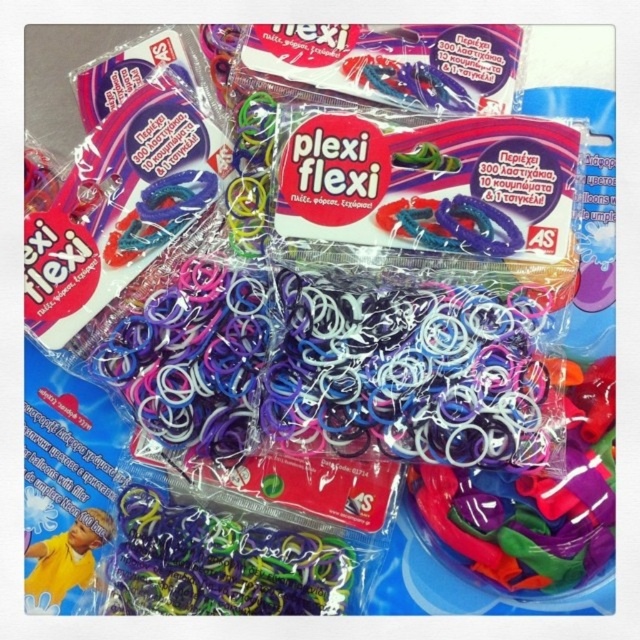
Does multicolored rubber bands at center have a smaller size compared to matte yellow toy at lower left?

No.

Does multicolored rubber bands at center lie behind matte yellow toy at lower left?

Yes, multicolored rubber bands at center is further from the viewer.

Who is more forward, (275, 531) or (96, 513)?

Point (96, 513) is in front.

You are a GUI agent. You are given a task and a screenshot of the screen. Output one action in this format:
    pyautogui.click(x=<x>, y=<y>)
    Task: Click on the multicolored rubber bands at center
    
    Given the screenshot: What is the action you would take?
    pyautogui.click(x=221, y=560)

Can you confirm if translucent rubber bands at center is bigger than multicolored rubber bands at center?

Correct, translucent rubber bands at center is larger in size than multicolored rubber bands at center.

This screenshot has width=640, height=640. Identify the location of translucent rubber bands at center. (531, 500).

Between point (422, 483) and point (211, 516), which one is positioned in front?

Point (211, 516) is in front.

This screenshot has width=640, height=640. In order to click on translucent rubber bands at center in this screenshot , I will do `click(531, 500)`.

Is translucent rubber bands at center above matte yellow toy at lower left?

Correct, translucent rubber bands at center is located above matte yellow toy at lower left.

Does translucent rubber bands at center have a lesser height compared to matte yellow toy at lower left?

In fact, translucent rubber bands at center may be taller than matte yellow toy at lower left.

Describe the element at coordinates (531, 500) in the screenshot. I see `translucent rubber bands at center` at that location.

The height and width of the screenshot is (640, 640). I want to click on translucent rubber bands at center, so click(x=531, y=500).